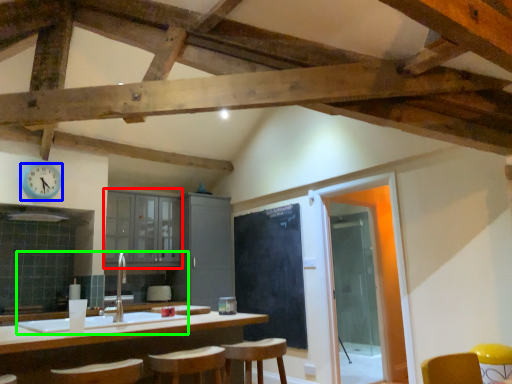
Question: Estimate the real-world distances between objects in this image. Which object is farther from cabinetry (highlighted by a red box), clock (highlighted by a blue box) or sink (highlighted by a green box)?

Choices:
 (A) clock
 (B) sink

Answer: (B)